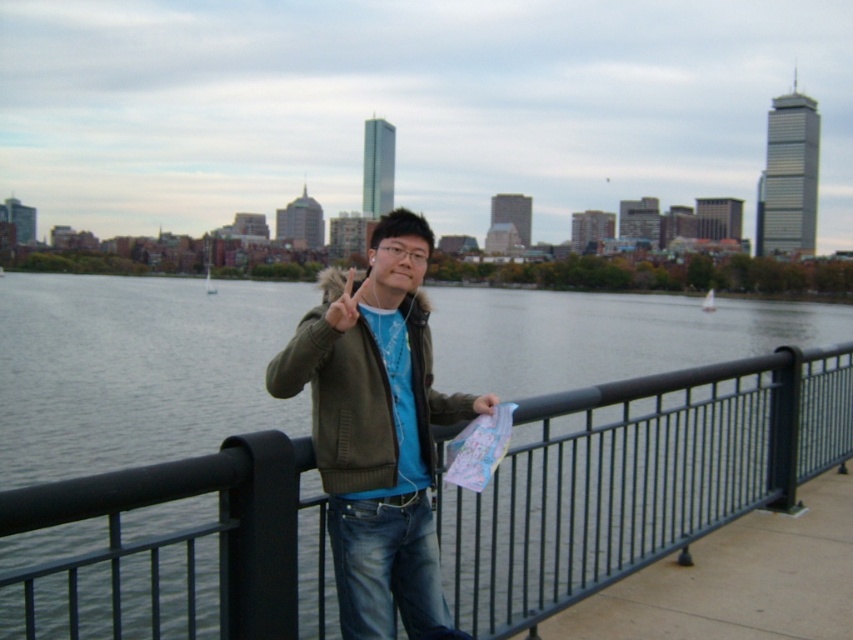
Question: Among these points, which one is nearest to the camera?

Choices:
 (A) coord(825,465)
 (B) coord(300,387)

Answer: (B)

Question: Which point is closer to the camera?

Choices:
 (A) tap(405, 490)
 (B) tap(268, 612)

Answer: (B)

Question: Does black metal fence at center appear over green fuzzy jacket at center?

Choices:
 (A) no
 (B) yes

Answer: (A)

Question: Which object is the farthest from the black metal fence at center?

Choices:
 (A) green fuzzy jacket at center
 (B) matte green jacket at center

Answer: (A)

Question: Considering the relative positions of black metal fence at center and green fuzzy jacket at center in the image provided, where is black metal fence at center located with respect to green fuzzy jacket at center?

Choices:
 (A) below
 (B) above

Answer: (A)

Question: Can you confirm if matte green jacket at center is positioned to the left of green fuzzy jacket at center?

Choices:
 (A) yes
 (B) no

Answer: (B)